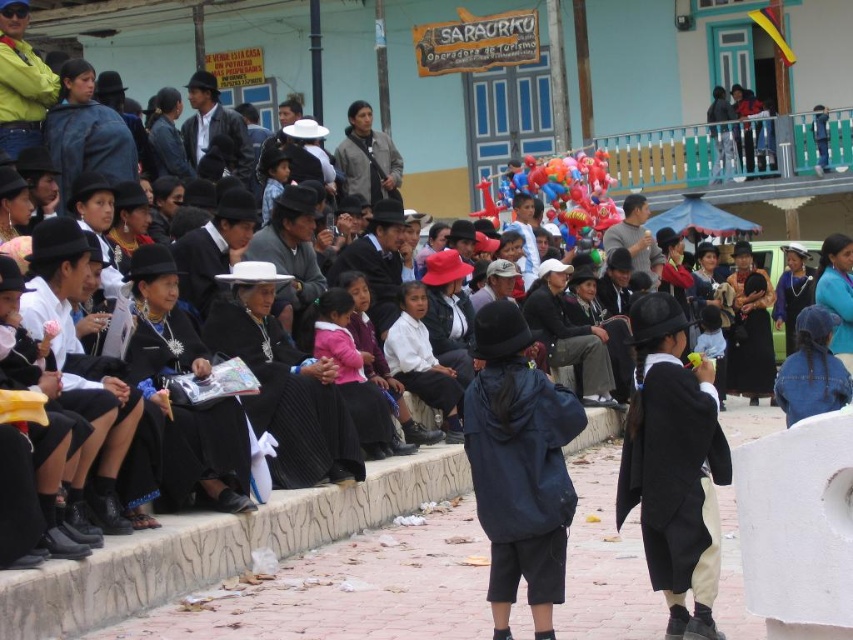
You are a photographer trying to capture the group of people on the stone wall. You want to focus on the navy blue fabric jacket at center and the matte black coat at center. Which of these two items is located to the left of the other?

The navy blue fabric jacket at center is positioned on the left side of the matte black coat at center.

You are organizing a photo shoot and need to ensure that the matte black coat at center and the multicolored glossy balloons at center are both visible in the frame. Given their sizes, which object should you prioritize placing closer to the camera to maintain clarity?

The matte black coat at center has a smaller width than the multicolored glossy balloons at center, so you should prioritize placing the multicolored glossy balloons at center closer to the camera to ensure both objects are clearly visible in the frame.